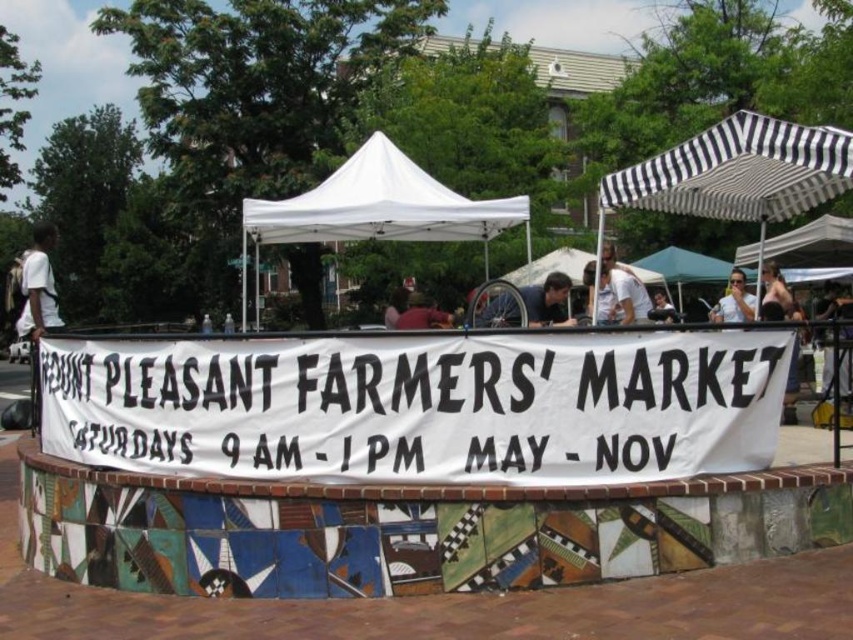
Question: Estimate the real-world distances between objects in this image. Which object is closer to the smooth gray wheelchair at center?

Choices:
 (A) smooth skin face at center
 (B) green fabric canopy at center
 (C) white shirt at left

Answer: (A)

Question: Can you confirm if white fabric banner at center is positioned below matte pink shirt at upper right?

Choices:
 (A) yes
 (B) no

Answer: (A)

Question: Does white shirt at left appear on the right side of green fabric canopy at center?

Choices:
 (A) yes
 (B) no

Answer: (B)

Question: Among these objects, which one is farthest from the camera?

Choices:
 (A) matte black sunglasses at upper right
 (B) dark blue fabric umbrella at upper right
 (C) white fabric tent at center
 (D) green fabric canopy at center

Answer: (D)

Question: Is smooth gray wheelchair at center to the right of matte black sunglasses at upper right from the viewer's perspective?

Choices:
 (A) yes
 (B) no

Answer: (B)

Question: Among these objects, which one is farthest from the camera?

Choices:
 (A) matte black sunglasses at upper right
 (B) white fabric banner at center

Answer: (A)